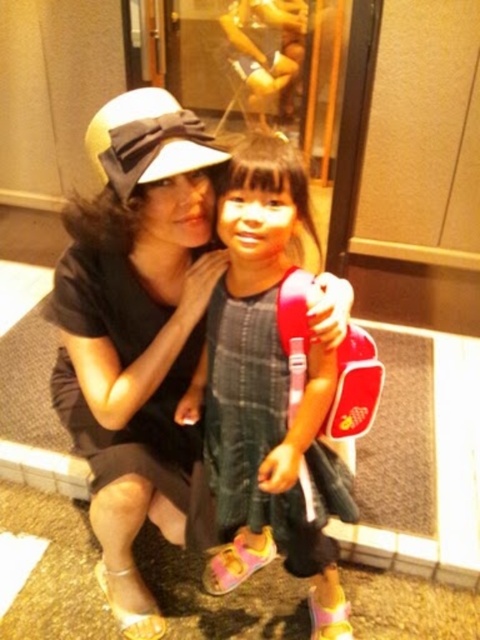
You are an interior designer assessing the layout of this room. The matte black hat at upper left and the plaid fabric dress at center are both in the foreground. Which object is positioned higher up in the image?

The matte black hat at upper left is located above the plaid fabric dress at center, so it is positioned higher up in the image.